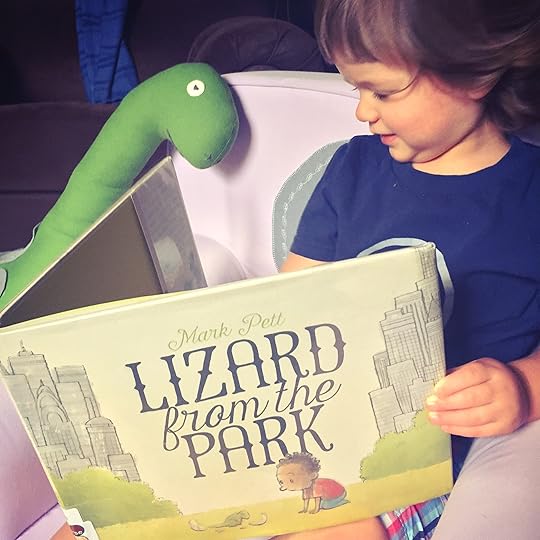
Where is `toy`? The image size is (540, 540). toy is located at coordinates (94, 171).